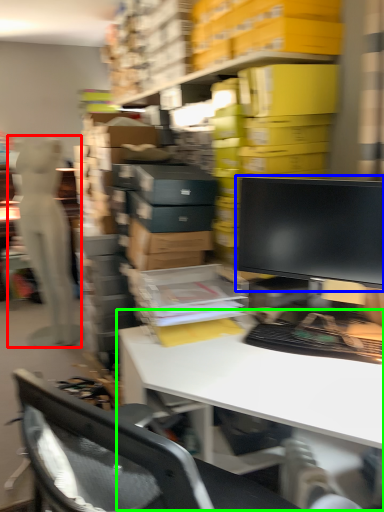
Question: Which object is positioned closest to person (highlighted by a red box)? Select from computer monitor (highlighted by a blue box) and desk (highlighted by a green box).

Choices:
 (A) computer monitor
 (B) desk

Answer: (B)